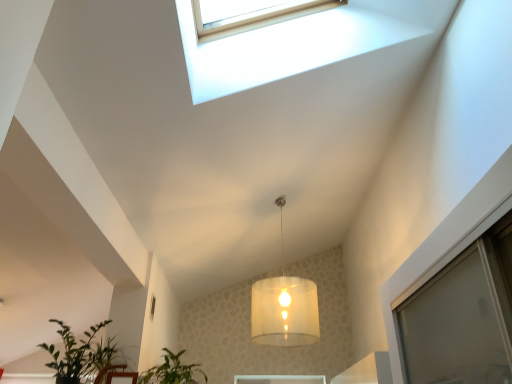
What do you see at coordinates (80, 354) in the screenshot? I see `green leafy plant at lower left, the first houseplant viewed from the left` at bounding box center [80, 354].

Measure the distance between green leafy plant at lower left, which is counted as the 2th houseplant, starting from the right, and camera.

→ A distance of 8.94 feet exists between green leafy plant at lower left, which is counted as the 2th houseplant, starting from the right, and camera.

I want to click on green leafy plant at lower center, which ranks as the 2th houseplant in left-to-right order, so click(x=172, y=371).

How different are the orientations of green leafy plant at lower left, the first houseplant viewed from the left, and translucent fabric lampshade at center in degrees?

87.3 degrees separate the facing orientations of green leafy plant at lower left, the first houseplant viewed from the left, and translucent fabric lampshade at center.

Could translucent fabric lampshade at center be considered to be inside green leafy plant at lower left, which is counted as the 2th houseplant, starting from the right?

No.

From the image's perspective, is green leafy plant at lower left, which is counted as the 2th houseplant, starting from the right, positioned above or below translucent fabric lampshade at center?

From the image's perspective, green leafy plant at lower left, which is counted as the 2th houseplant, starting from the right, appears below translucent fabric lampshade at center.

Which object is thinner, green leafy plant at lower left, which is counted as the 2th houseplant, starting from the right, or translucent fabric lampshade at center?

With smaller width is green leafy plant at lower left, which is counted as the 2th houseplant, starting from the right.

In the image, is green leafy plant at lower center, which ranks as the 2th houseplant in left-to-right order, positioned in front of or behind green leafy plant at lower left, which is counted as the 2th houseplant, starting from the right?

green leafy plant at lower center, which ranks as the 2th houseplant in left-to-right order, is behind green leafy plant at lower left, which is counted as the 2th houseplant, starting from the right.

Looking at this image, is green leafy plant at lower center, which ranks as the 2th houseplant in left-to-right order, aimed at green leafy plant at lower left, the first houseplant viewed from the left?

Yes, green leafy plant at lower center, which ranks as the 2th houseplant in left-to-right order, is aimed at green leafy plant at lower left, the first houseplant viewed from the left.

Between green leafy plant at lower center, which ranks as the 2th houseplant in left-to-right order, and green leafy plant at lower left, which is counted as the 2th houseplant, starting from the right, which one appears on the right side from the viewer's perspective?

From the viewer's perspective, green leafy plant at lower center, which ranks as the 2th houseplant in left-to-right order, appears more on the right side.

Between green leafy plant at lower center, which ranks as the 2th houseplant in left-to-right order, and green leafy plant at lower left, the first houseplant viewed from the left, which one has larger size?

green leafy plant at lower left, the first houseplant viewed from the left.

Is translucent fabric lampshade at center wider or thinner than green leafy plant at lower center, the first houseplant in the right-to-left sequence?

Clearly, translucent fabric lampshade at center has more width compared to green leafy plant at lower center, the first houseplant in the right-to-left sequence.

This screenshot has width=512, height=384. I want to click on lamp above the green leafy plant at lower center, the first houseplant in the right-to-left sequence (from the image's perspective), so click(284, 307).

Between translucent fabric lampshade at center and green leafy plant at lower center, which ranks as the 2th houseplant in left-to-right order, which one has smaller size?

Smaller between the two is green leafy plant at lower center, which ranks as the 2th houseplant in left-to-right order.

From a real-world perspective, who is located lower, translucent fabric lampshade at center or green leafy plant at lower center, the first houseplant in the right-to-left sequence?

green leafy plant at lower center, the first houseplant in the right-to-left sequence, from a real-world perspective.

Is translucent fabric lampshade at center at the right side of green leafy plant at lower left, which is counted as the 2th houseplant, starting from the right?

Correct, you'll find translucent fabric lampshade at center to the right of green leafy plant at lower left, which is counted as the 2th houseplant, starting from the right.

What's the angular difference between translucent fabric lampshade at center and green leafy plant at lower left, the first houseplant viewed from the left,'s facing directions?

The angular difference between translucent fabric lampshade at center and green leafy plant at lower left, the first houseplant viewed from the left, is 87.3 degrees.

Measure the distance from translucent fabric lampshade at center to green leafy plant at lower left, which is counted as the 2th houseplant, starting from the right.

translucent fabric lampshade at center is 7.63 feet from green leafy plant at lower left, which is counted as the 2th houseplant, starting from the right.

Which houseplant is the 2nd one when counting from the front of the translucent fabric lampshade at center? Please provide its 2D coordinates.

[(80, 354)]

Is green leafy plant at lower center, which ranks as the 2th houseplant in left-to-right order, looking in the opposite direction of translucent fabric lampshade at center?

That's not correct — green leafy plant at lower center, which ranks as the 2th houseplant in left-to-right order, is not looking away from translucent fabric lampshade at center.

Is green leafy plant at lower center, which ranks as the 2th houseplant in left-to-right order, taller or shorter than translucent fabric lampshade at center?

green leafy plant at lower center, which ranks as the 2th houseplant in left-to-right order, is shorter than translucent fabric lampshade at center.

Can translucent fabric lampshade at center be found inside green leafy plant at lower center, which ranks as the 2th houseplant in left-to-right order?

No, translucent fabric lampshade at center is not inside green leafy plant at lower center, which ranks as the 2th houseplant in left-to-right order.

Who is bigger, green leafy plant at lower center, which ranks as the 2th houseplant in left-to-right order, or translucent fabric lampshade at center?

Bigger between the two is translucent fabric lampshade at center.

Would you say green leafy plant at lower left, which is counted as the 2th houseplant, starting from the right, is to the left or to the right of green leafy plant at lower center, which ranks as the 2th houseplant in left-to-right order, in the picture?

Clearly, green leafy plant at lower left, which is counted as the 2th houseplant, starting from the right, is on the left of green leafy plant at lower center, which ranks as the 2th houseplant in left-to-right order, in the image.

Is green leafy plant at lower left, the first houseplant viewed from the left, positioned beyond the bounds of green leafy plant at lower center, which ranks as the 2th houseplant in left-to-right order?

green leafy plant at lower left, the first houseplant viewed from the left, lies outside green leafy plant at lower center, which ranks as the 2th houseplant in left-to-right order,'s area.

From the image's perspective, which one is positioned higher, green leafy plant at lower left, which is counted as the 2th houseplant, starting from the right, or green leafy plant at lower center, the first houseplant in the right-to-left sequence?

green leafy plant at lower left, which is counted as the 2th houseplant, starting from the right, appears higher in the image.

From a real-world perspective, between green leafy plant at lower left, the first houseplant viewed from the left, and green leafy plant at lower center, the first houseplant in the right-to-left sequence, who is vertically lower?

From a 3D spatial view, green leafy plant at lower center, the first houseplant in the right-to-left sequence, is below.

The width and height of the screenshot is (512, 384). What are the coordinates of `the 2nd houseplant to the left when counting from the translucent fabric lampshade at center` in the screenshot? It's located at (80, 354).

I want to click on houseplant in front of the green leafy plant at lower center, the first houseplant in the right-to-left sequence, so click(x=80, y=354).

From the image, which object appears to be nearer to green leafy plant at lower left, the first houseplant viewed from the left, translucent fabric lampshade at center or green leafy plant at lower center, which ranks as the 2th houseplant in left-to-right order?

Based on the image, green leafy plant at lower center, which ranks as the 2th houseplant in left-to-right order, appears to be nearer to green leafy plant at lower left, the first houseplant viewed from the left.

From the image, which object appears to be nearer to translucent fabric lampshade at center, green leafy plant at lower left, which is counted as the 2th houseplant, starting from the right, or green leafy plant at lower center, the first houseplant in the right-to-left sequence?

green leafy plant at lower center, the first houseplant in the right-to-left sequence.

Based on the photo, based on their spatial positions, is green leafy plant at lower left, the first houseplant viewed from the left, or translucent fabric lampshade at center closer to green leafy plant at lower center, the first houseplant in the right-to-left sequence?

Among the two, green leafy plant at lower left, the first houseplant viewed from the left, is located nearer to green leafy plant at lower center, the first houseplant in the right-to-left sequence.

From the image, which object appears to be farther from green leafy plant at lower left, the first houseplant viewed from the left, green leafy plant at lower center, which ranks as the 2th houseplant in left-to-right order, or translucent fabric lampshade at center?

Among the two, translucent fabric lampshade at center is located further to green leafy plant at lower left, the first houseplant viewed from the left.

Based on their spatial positions, is translucent fabric lampshade at center or green leafy plant at lower left, the first houseplant viewed from the left, closer to green leafy plant at lower center, the first houseplant in the right-to-left sequence?

green leafy plant at lower left, the first houseplant viewed from the left, lies closer to green leafy plant at lower center, the first houseplant in the right-to-left sequence, than the other object.

Based on the photo, based on their spatial positions, is green leafy plant at lower center, the first houseplant in the right-to-left sequence, or green leafy plant at lower left, which is counted as the 2th houseplant, starting from the right, further from translucent fabric lampshade at center?

green leafy plant at lower left, which is counted as the 2th houseplant, starting from the right, is positioned further to the anchor translucent fabric lampshade at center.

You are a GUI agent. You are given a task and a screenshot of the screen. Output one action in this format:
    pyautogui.click(x=<x>, y=<y>)
    Task: Click on the houseplant located between green leafy plant at lower left, which is counted as the 2th houseplant, starting from the right, and translucent fabric lampshade at center in the left-right direction
    This screenshot has height=384, width=512.
    Given the screenshot: What is the action you would take?
    pyautogui.click(x=172, y=371)